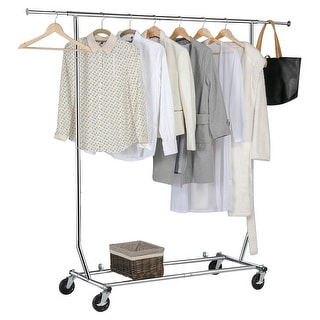
What are the coordinates of `clothes on hangers` in the screenshot? It's located at (113, 54), (149, 55), (173, 59), (198, 63), (231, 62), (251, 61).